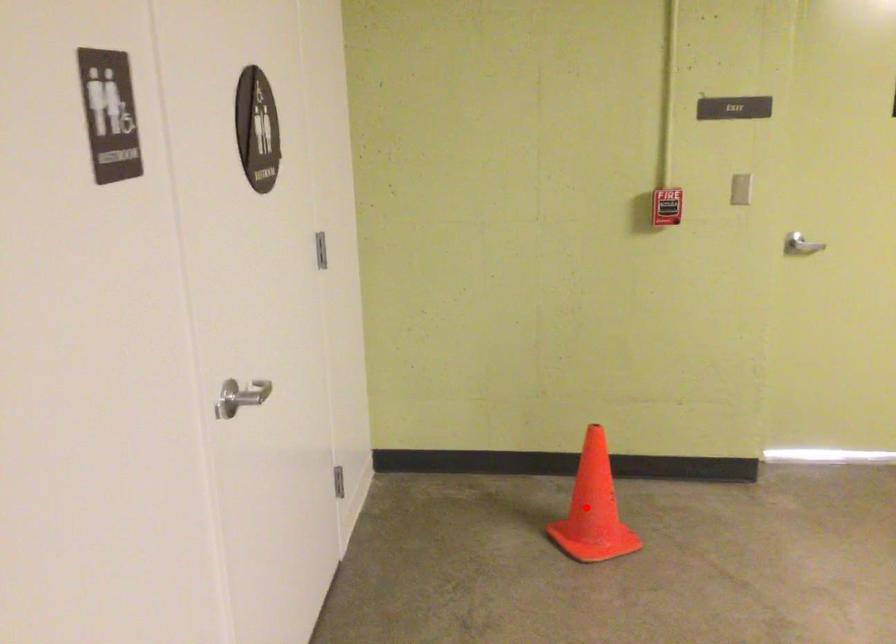
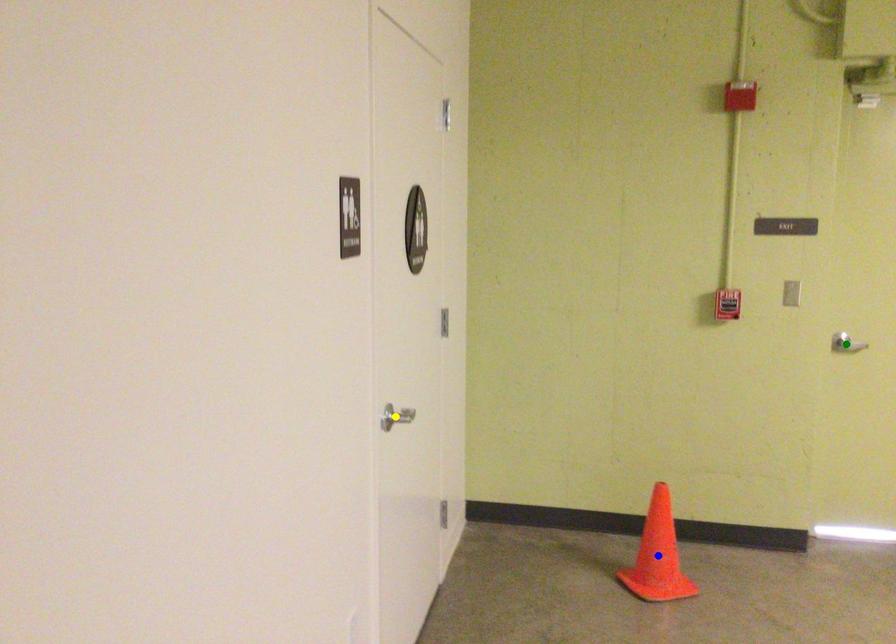
Question: I am providing you with two images of the same scene from different viewpoints. A red point is marked on the first image. You are given multiple points on the second image. Can you choose the point in image 2 that corresponds to the point in image 1?

Choices:
 (A) yellow point
 (B) green point
 (C) blue point

Answer: (C)